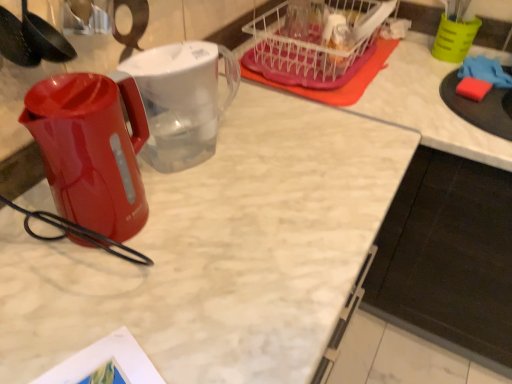
Where is `vacant area to the right of transparent plastic pitcher at center`? The width and height of the screenshot is (512, 384). vacant area to the right of transparent plastic pitcher at center is located at coordinates coord(272,160).